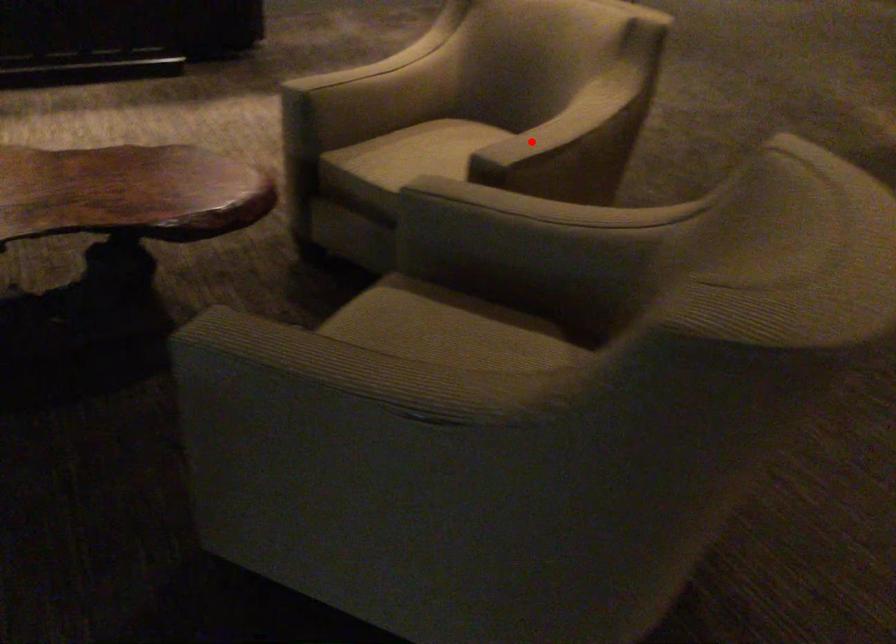
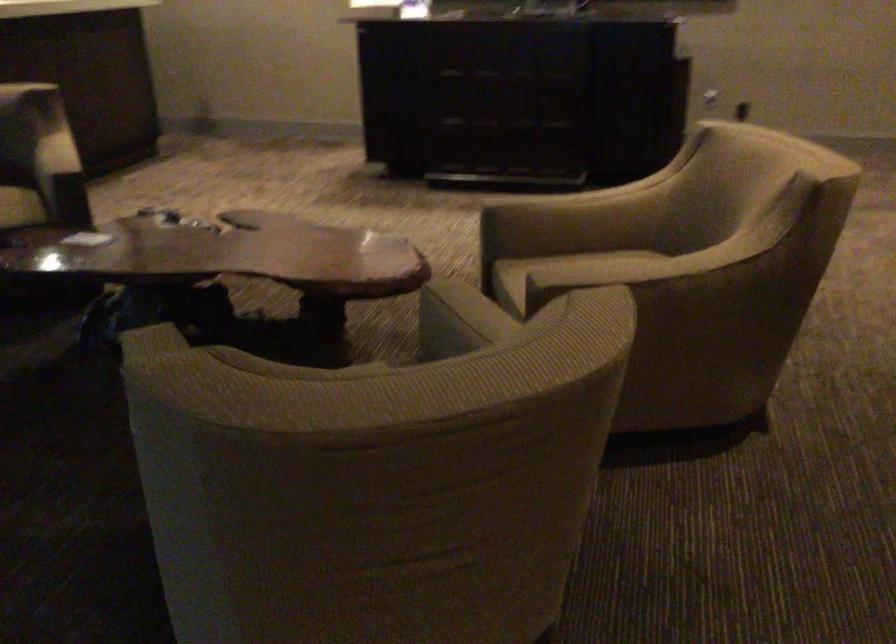
Where in the second image is the point corresponding to the highlighted location from the first image?

(599, 272)